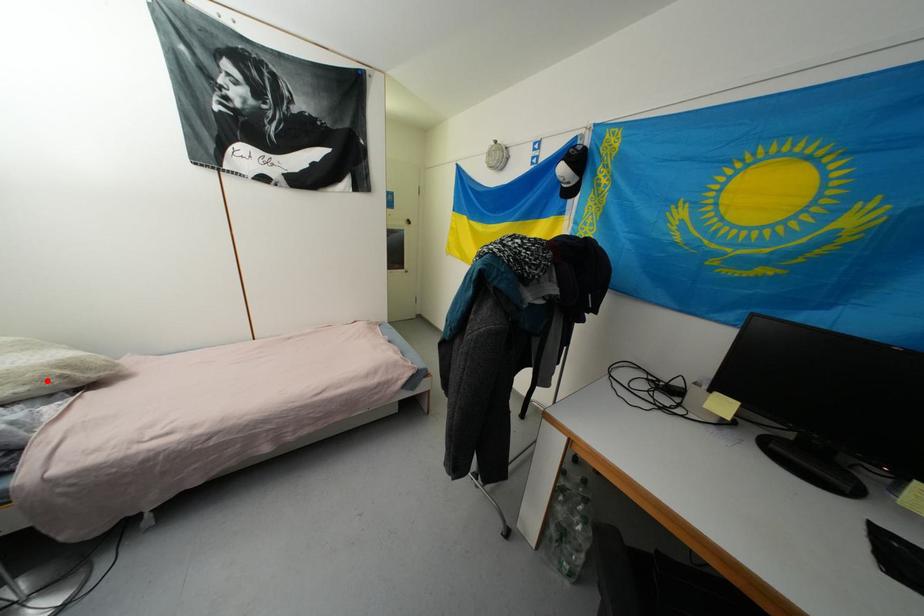
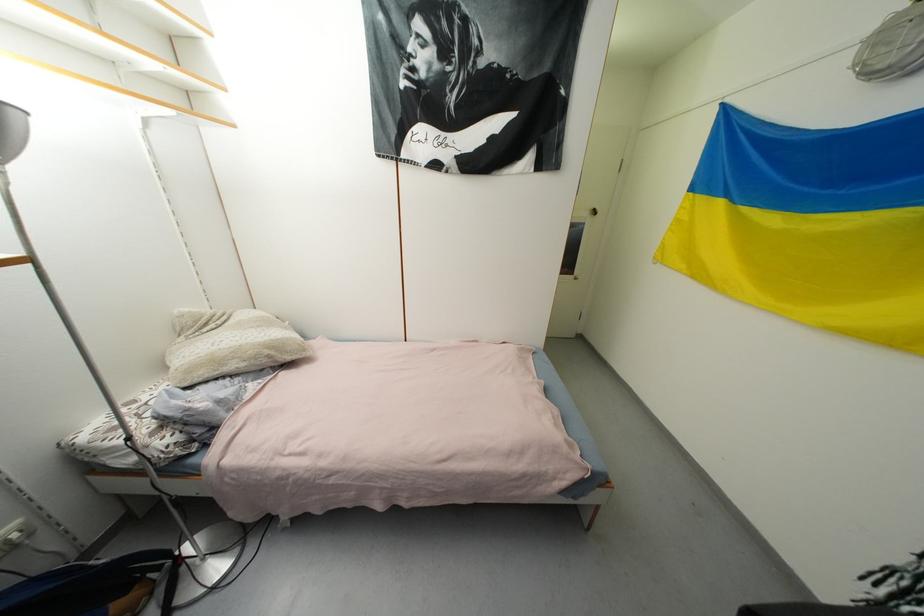
Question: I am providing you with two images of the same scene from different viewpoints. Given a red point in image1, look at the same physical point in image2. Is it:

Choices:
 (A) Closer to the viewpoint
 (B) Farther from the viewpoint

Answer: (A)